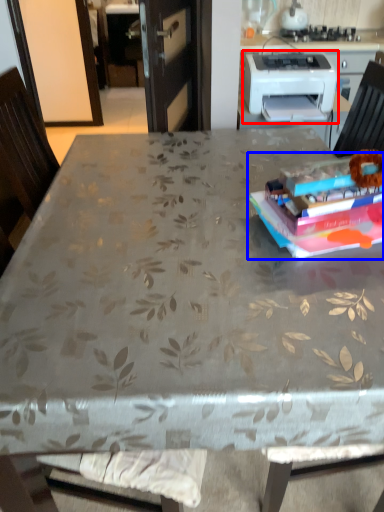
Question: Which of the following is the closest to the observer, printer (highlighted by a red box) or paperback book (highlighted by a blue box)?

Choices:
 (A) printer
 (B) paperback book

Answer: (B)